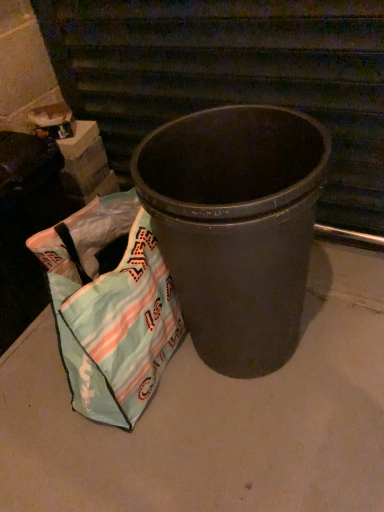
Locate an element on the screen. The image size is (384, 512). matte black trash can at center is located at coordinates (236, 226).

In terms of size, does matte black trash can at center appear bigger or smaller than textured fabric bag at lower left?

In the image, matte black trash can at center appears to be larger than textured fabric bag at lower left.

Is matte black trash can at center positioned beyond the bounds of textured fabric bag at lower left?

Yes.

Is point (285, 277) positioned before point (65, 292)?

Yes.

From a real-world perspective, which object rests below the other?

textured fabric bag at lower left.

Would you say textured fabric bag at lower left contains matte black trash can at center?

That's incorrect, matte black trash can at center is not inside textured fabric bag at lower left.

Can you tell me how much textured fabric bag at lower left and matte black trash can at center differ in facing direction?

textured fabric bag at lower left and matte black trash can at center are facing 102 degrees away from each other.

Could you tell me if textured fabric bag at lower left is facing matte black trash can at center?

Yes.

Consider the image. Is the depth of textured fabric bag at lower left greater than that of matte black trash can at center?

Yes, the depth of textured fabric bag at lower left is greater than that of matte black trash can at center.

Where is `waste container that appears above the matte gray concrete at center (from a real-world perspective)`? waste container that appears above the matte gray concrete at center (from a real-world perspective) is located at coordinates (236, 226).

In terms of size, does matte black trash can at center appear bigger or smaller than matte gray concrete at center?

In the image, matte black trash can at center appears to be larger than matte gray concrete at center.

Which object is further away from the camera, matte black trash can at center or matte gray concrete at center?

matte gray concrete at center.

What's the angular difference between matte black trash can at center and matte gray concrete at center's facing directions?

11.1 degrees separate the facing orientations of matte black trash can at center and matte gray concrete at center.

Which object is positioned more to the right, textured fabric bag at lower left or matte gray concrete at center?

Positioned to the right is matte gray concrete at center.

Is textured fabric bag at lower left taller than matte gray concrete at center?

Indeed, textured fabric bag at lower left has a greater height compared to matte gray concrete at center.

Where is `concrete on the right side of textured fabric bag at lower left`? The height and width of the screenshot is (512, 384). concrete on the right side of textured fabric bag at lower left is located at coordinates (215, 418).

Considering the sizes of textured fabric bag at lower left and matte gray concrete at center in the image, is textured fabric bag at lower left bigger or smaller than matte gray concrete at center?

In the image, textured fabric bag at lower left appears to be smaller than matte gray concrete at center.

Is matte gray concrete at center turned away from textured fabric bag at lower left?

matte gray concrete at center is not turned away from textured fabric bag at lower left.

In the image, is matte gray concrete at center positioned in front of or behind textured fabric bag at lower left?

In the image, matte gray concrete at center appears in front of textured fabric bag at lower left.

You are a GUI agent. You are given a task and a screenshot of the screen. Output one action in this format:
    pyautogui.click(x=<x>, y=<y>)
    Task: Click on the concrete below the textured fabric bag at lower left (from the image's perspective)
    
    Given the screenshot: What is the action you would take?
    pyautogui.click(x=215, y=418)

Considering the positions of objects matte gray concrete at center and matte black trash can at center in the image provided, who is more to the left, matte gray concrete at center or matte black trash can at center?

Positioned to the left is matte gray concrete at center.

Are matte gray concrete at center and matte black trash can at center far apart?

matte gray concrete at center is actually quite close to matte black trash can at center.

At what (x,y) coordinates should I click in order to perform the action: click on concrete behind the matte black trash can at center. Please return your answer as a coordinate pair (x, y). The height and width of the screenshot is (512, 384). Looking at the image, I should click on [x=215, y=418].

Is matte gray concrete at center oriented away from matte black trash can at center?

matte gray concrete at center is not turned away from matte black trash can at center.

I want to click on waste container above the textured fabric bag at lower left (from the image's perspective), so click(x=236, y=226).

Where is `grocery bag on the left of matte black trash can at center`? grocery bag on the left of matte black trash can at center is located at coordinates (111, 309).

Looking at the image, which one is located further to matte gray concrete at center, textured fabric bag at lower left or matte black trash can at center?

Among the two, matte black trash can at center is located further to matte gray concrete at center.

Looking at the image, which one is located further to matte black trash can at center, textured fabric bag at lower left or matte gray concrete at center?

matte gray concrete at center is further to matte black trash can at center.

Looking at the image, which one is located closer to textured fabric bag at lower left, matte black trash can at center or matte gray concrete at center?

Based on the image, matte black trash can at center appears to be nearer to textured fabric bag at lower left.

Estimate the real-world distances between objects in this image. Which object is further from matte black trash can at center, matte gray concrete at center or textured fabric bag at lower left?

matte gray concrete at center is positioned further to the anchor matte black trash can at center.

From the image, which object appears to be farther from textured fabric bag at lower left, matte gray concrete at center or matte black trash can at center?

matte gray concrete at center is further to textured fabric bag at lower left.

Estimate the real-world distances between objects in this image. Which object is further from matte gray concrete at center, matte black trash can at center or textured fabric bag at lower left?

Based on the image, matte black trash can at center appears to be further to matte gray concrete at center.

The image size is (384, 512). I want to click on concrete between textured fabric bag at lower left and matte black trash can at center in the horizontal direction, so click(215, 418).